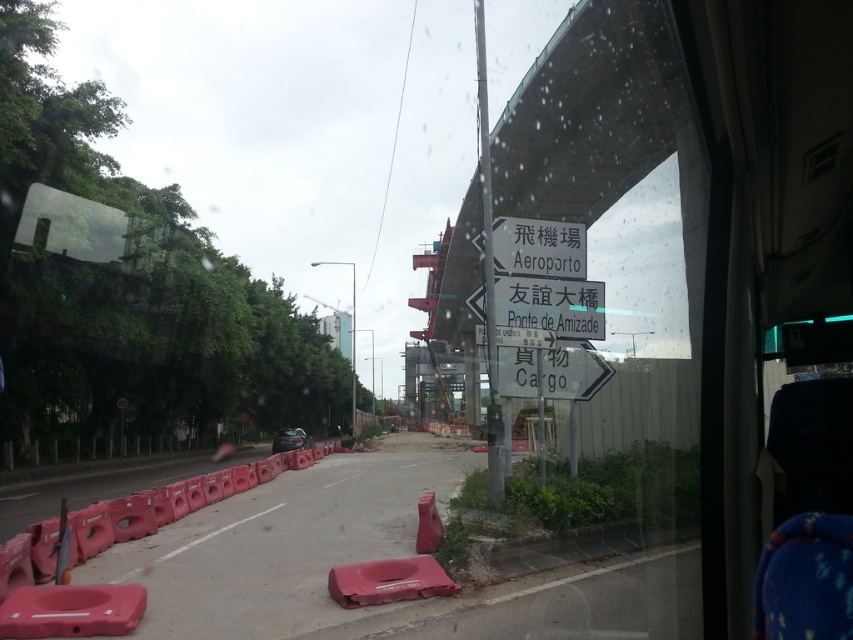
Is point (277, 452) farther from viewer compared to point (581, 262)?

Yes, point (277, 452) is behind point (581, 262).

Where is `rubberized plastic barriers at lower left`? rubberized plastic barriers at lower left is located at coordinates (172, 500).

Does point (181, 480) lie behind point (500, 236)?

Yes.

The width and height of the screenshot is (853, 640). Find the location of `rubberized plastic barriers at lower left`. rubberized plastic barriers at lower left is located at coordinates tap(172, 500).

Does white plastic sign at center come in front of white paper sign at center?

No, it is not.

Can you confirm if white plastic sign at center is smaller than white paper sign at center?

Yes, white plastic sign at center is smaller than white paper sign at center.

Between point (482, 296) and point (517, 250), which one is positioned in front?

Positioned in front is point (482, 296).

You are a GUI agent. You are given a task and a screenshot of the screen. Output one action in this format:
    pyautogui.click(x=<x>, y=<y>)
    Task: Click on the white plastic sign at center
    Image resolution: width=853 pixels, height=640 pixels.
    Given the screenshot: What is the action you would take?
    pyautogui.click(x=550, y=305)

Who is shorter, rubberized plastic barriers at lower left or white plastic sign at center?

Standing shorter between the two is white plastic sign at center.

Between rubberized plastic barriers at lower left and white plastic sign at center, which one is positioned higher?

Positioned higher is white plastic sign at center.

Which is in front, point (161, 500) or point (561, 282)?

Point (561, 282)

Identify the location of rubberized plastic barriers at lower left. (172, 500).